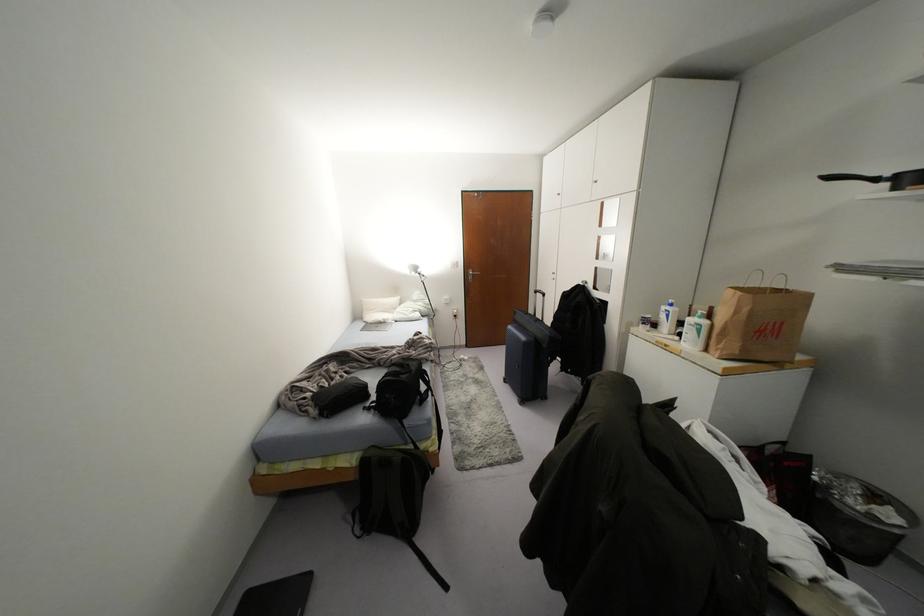
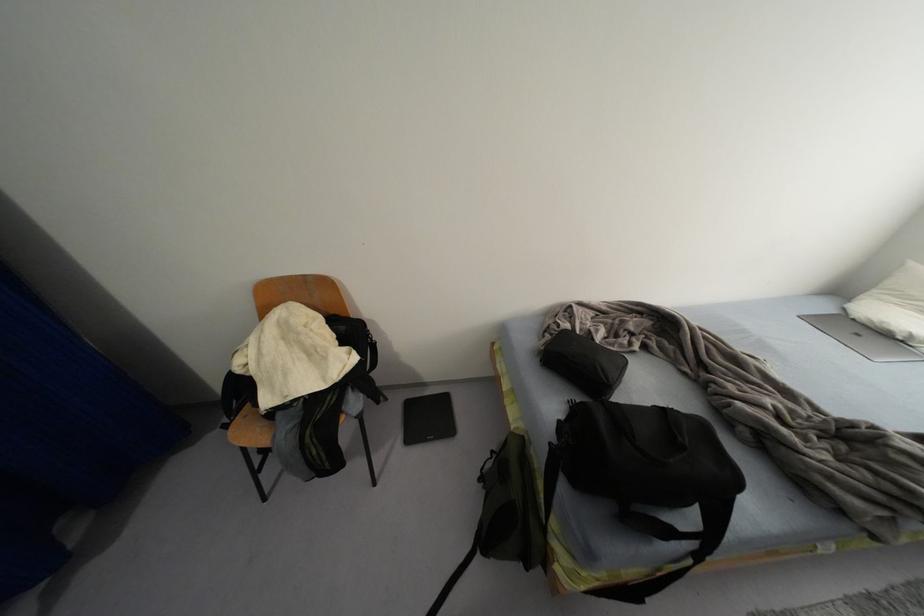
Based on the continuous images, in which direction is the camera rotating?

The camera rotated toward left-down.